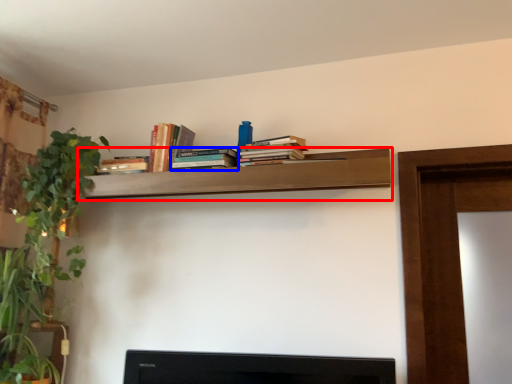
Question: Which object appears farthest to the camera in this image, shelf (highlighted by a red box) or book (highlighted by a blue box)?

Choices:
 (A) shelf
 (B) book

Answer: (B)